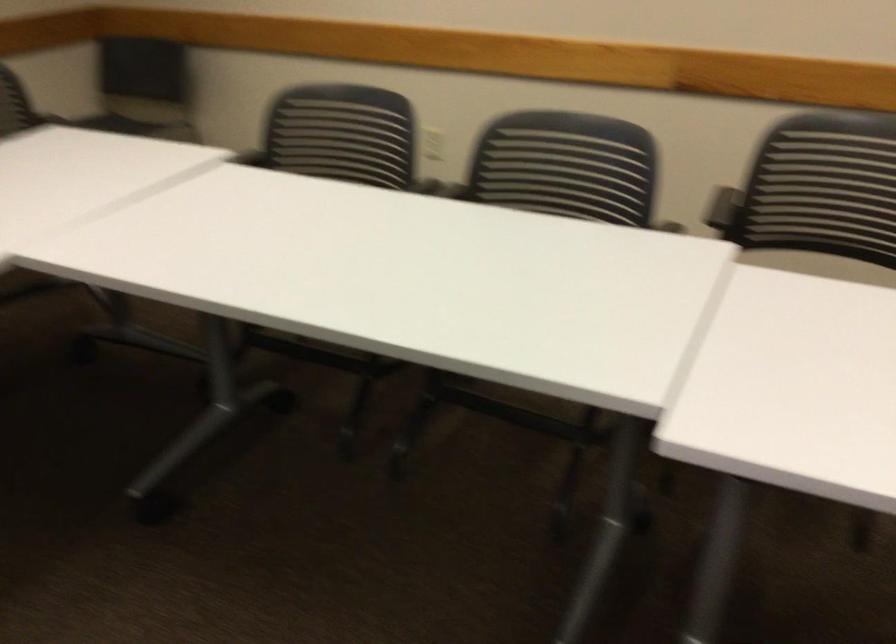
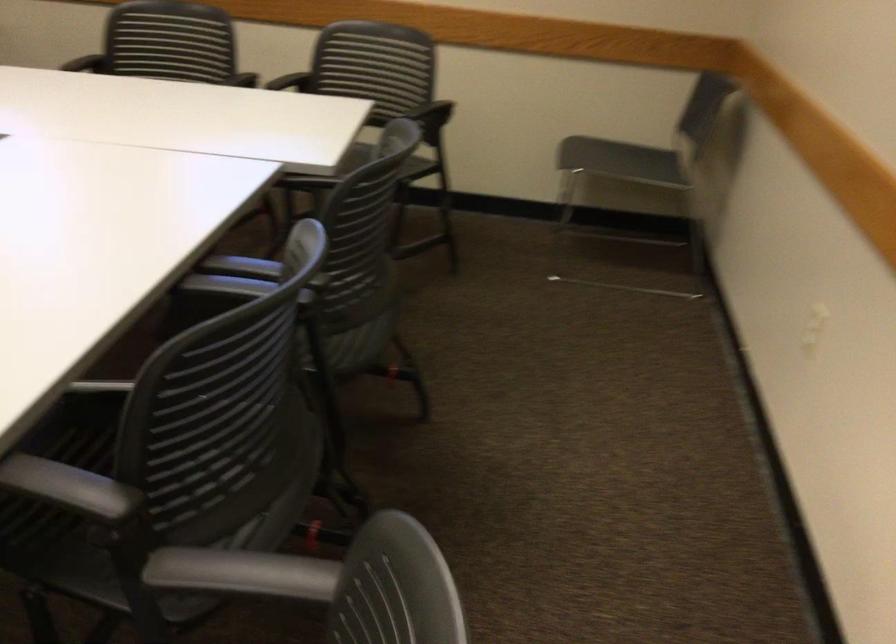
The point at (659,243) is marked in the first image. Where is the corresponding point in the second image?

(71, 488)